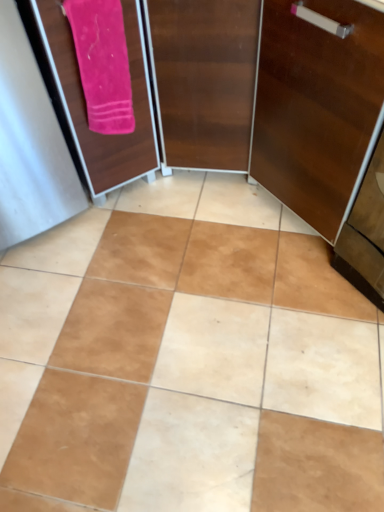
Question: Considering the relative sizes of pink soft towel at upper left and pink fabric screen door at upper left in the image provided, is pink soft towel at upper left taller than pink fabric screen door at upper left?

Choices:
 (A) no
 (B) yes

Answer: (A)

Question: Is pink soft towel at upper left thinner than pink fabric screen door at upper left?

Choices:
 (A) yes
 (B) no

Answer: (A)

Question: From a real-world perspective, is pink soft towel at upper left over pink fabric screen door at upper left?

Choices:
 (A) no
 (B) yes

Answer: (B)

Question: Does pink soft towel at upper left have a greater width compared to pink fabric screen door at upper left?

Choices:
 (A) no
 (B) yes

Answer: (A)

Question: From the image's perspective, is pink soft towel at upper left on pink fabric screen door at upper left?

Choices:
 (A) no
 (B) yes

Answer: (A)

Question: Would you say pink fabric screen door at upper left is to the left or to the right of wooden cabinet at right in the picture?

Choices:
 (A) left
 (B) right

Answer: (A)

Question: From a real-world perspective, relative to wooden cabinet at right, is pink fabric screen door at upper left vertically above or below?

Choices:
 (A) above
 (B) below

Answer: (B)

Question: From their relative heights in the image, would you say pink fabric screen door at upper left is taller or shorter than wooden cabinet at right?

Choices:
 (A) short
 (B) tall

Answer: (A)

Question: Considering their positions, is pink fabric screen door at upper left located in front of or behind wooden cabinet at right?

Choices:
 (A) behind
 (B) front

Answer: (A)

Question: From the image's perspective, relative to brown matte tile at center, is wooden cabinet at right above or below?

Choices:
 (A) below
 (B) above

Answer: (B)

Question: Considering their positions, is wooden cabinet at right located in front of or behind brown matte tile at center?

Choices:
 (A) front
 (B) behind

Answer: (A)

Question: From their relative heights in the image, would you say wooden cabinet at right is taller or shorter than brown matte tile at center?

Choices:
 (A) tall
 (B) short

Answer: (A)

Question: From a real-world perspective, is wooden cabinet at right above or below brown matte tile at center?

Choices:
 (A) above
 (B) below

Answer: (A)

Question: Is wooden cabinet at right inside the boundaries of pink soft towel at upper left, or outside?

Choices:
 (A) outside
 (B) inside

Answer: (A)

Question: Considering the positions of wooden cabinet at right and pink soft towel at upper left in the image, is wooden cabinet at right taller or shorter than pink soft towel at upper left?

Choices:
 (A) tall
 (B) short

Answer: (A)